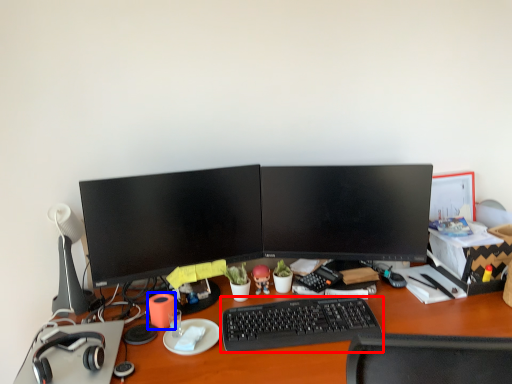
Question: Which of the following is the closest to the observer, computer keyboard (highlighted by a red box) or stationery (highlighted by a blue box)?

Choices:
 (A) computer keyboard
 (B) stationery

Answer: (A)